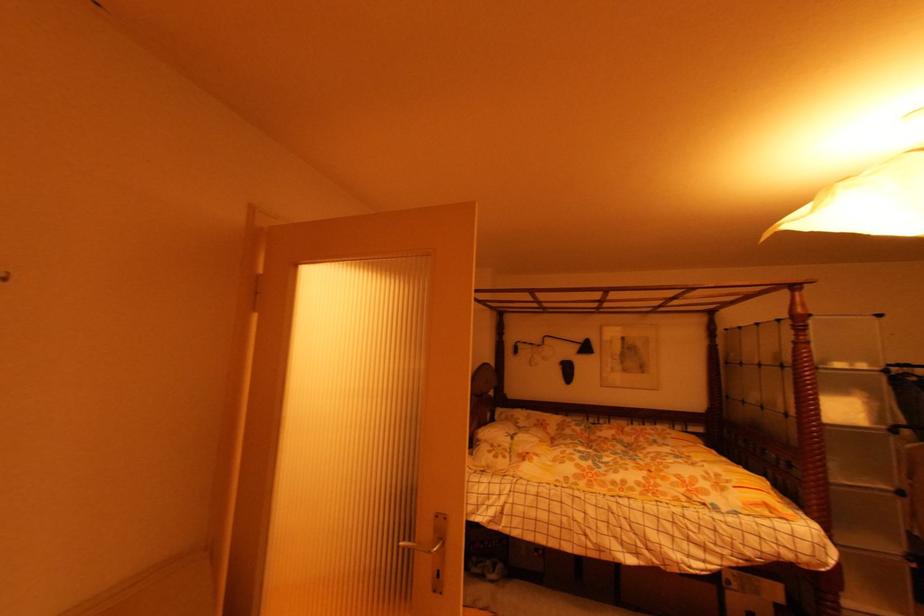
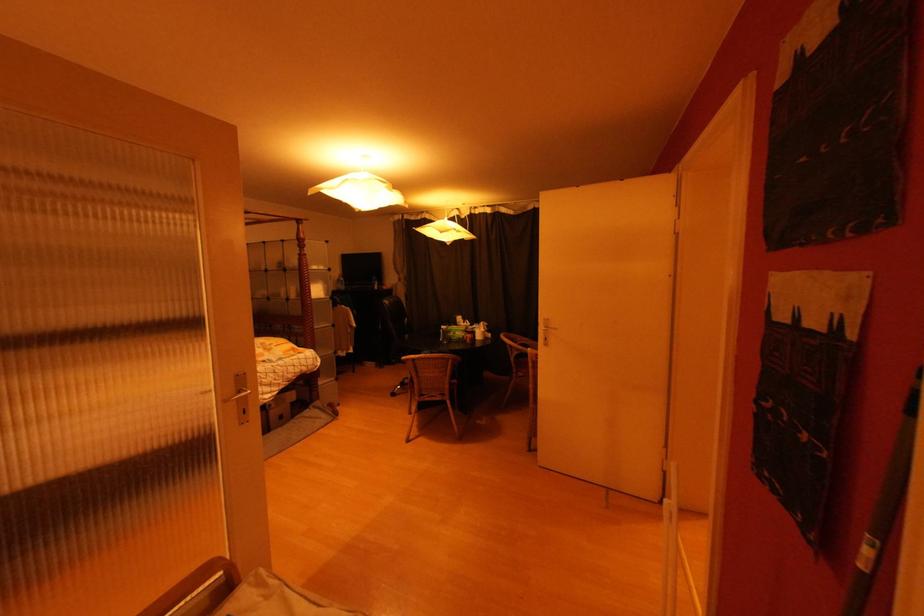
Locate, in the second image, the point that corresponds to point (442, 578) in the first image.

(249, 415)